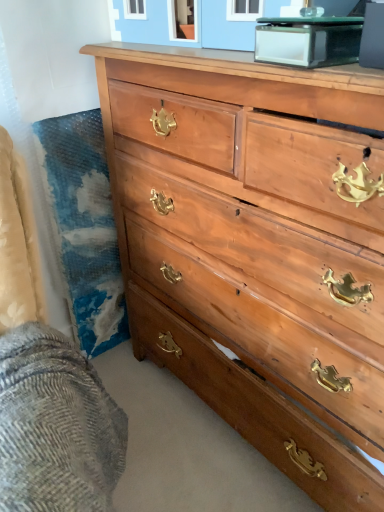
Question: Considering the positions of woolen fabric at lower left and light brown wood chest of drawers at center in the image, is woolen fabric at lower left wider or thinner than light brown wood chest of drawers at center?

Choices:
 (A) thin
 (B) wide

Answer: (A)

Question: Does point (38, 387) appear closer or farther from the camera than point (274, 201)?

Choices:
 (A) farther
 (B) closer

Answer: (B)

Question: Which object is positioned farthest from the clear glass table at upper center?

Choices:
 (A) woolen fabric at lower left
 (B) light brown wood chest of drawers at center

Answer: (A)

Question: Which is farther from the woolen fabric at lower left?

Choices:
 (A) clear glass table at upper center
 (B) light brown wood chest of drawers at center

Answer: (A)